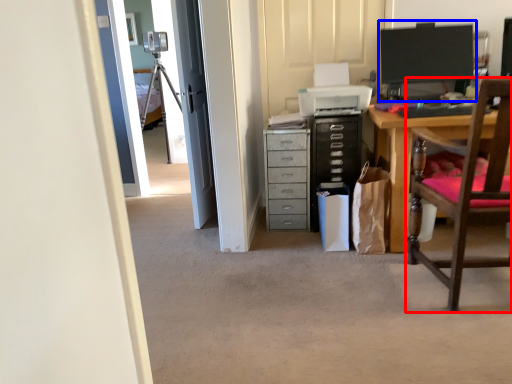
Question: Among these objects, which one is farthest to the camera, chair (highlighted by a red box) or computer monitor (highlighted by a blue box)?

Choices:
 (A) chair
 (B) computer monitor

Answer: (B)